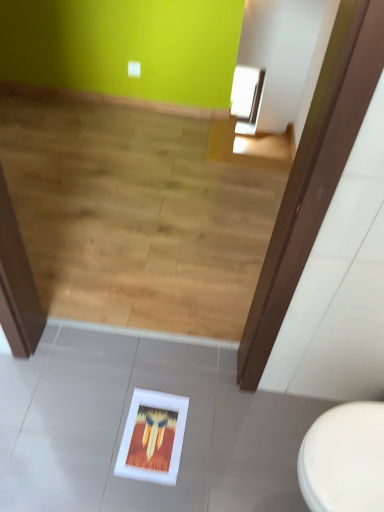
Question: Is the depth of white matte picture frame at lower center less than that of wooden floor at lower center?

Choices:
 (A) yes
 (B) no

Answer: (A)

Question: Can you confirm if white matte picture frame at lower center is taller than wooden floor at lower center?

Choices:
 (A) no
 (B) yes

Answer: (A)

Question: Can you see white matte picture frame at lower center touching wooden floor at lower center?

Choices:
 (A) no
 (B) yes

Answer: (A)

Question: Would you say white matte picture frame at lower center is outside wooden floor at lower center?

Choices:
 (A) yes
 (B) no

Answer: (A)

Question: Is the position of white matte picture frame at lower center more distant than that of wooden floor at lower center?

Choices:
 (A) yes
 (B) no

Answer: (B)

Question: Is white matte picture frame at lower center to the left of wooden floor at lower center from the viewer's perspective?

Choices:
 (A) yes
 (B) no

Answer: (B)

Question: Considering the relative sizes of white glossy toilet at lower right and white matte picture frame at lower center in the image provided, is white glossy toilet at lower right shorter than white matte picture frame at lower center?

Choices:
 (A) no
 (B) yes

Answer: (A)

Question: Is white glossy toilet at lower right next to white matte picture frame at lower center?

Choices:
 (A) no
 (B) yes

Answer: (A)

Question: Is white glossy toilet at lower right thinner than white matte picture frame at lower center?

Choices:
 (A) no
 (B) yes

Answer: (A)

Question: Is white matte picture frame at lower center surrounded by white glossy toilet at lower right?

Choices:
 (A) no
 (B) yes

Answer: (A)

Question: Does white glossy toilet at lower right have a greater height compared to white matte picture frame at lower center?

Choices:
 (A) yes
 (B) no

Answer: (A)

Question: Does white glossy toilet at lower right have a greater width compared to white matte picture frame at lower center?

Choices:
 (A) yes
 (B) no

Answer: (A)

Question: Is wooden floor at lower center at the right side of white glossy toilet at lower right?

Choices:
 (A) yes
 (B) no

Answer: (B)